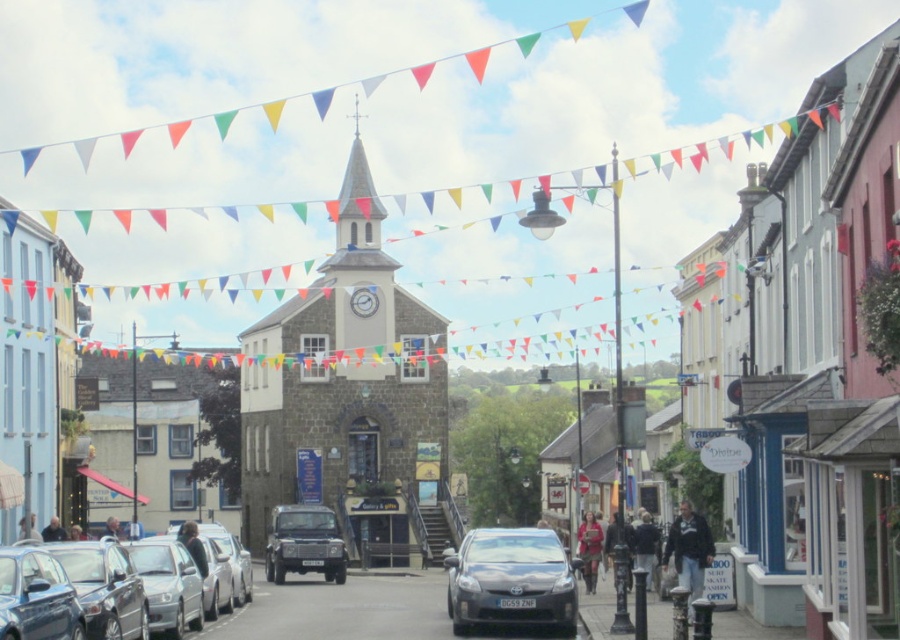
Question: Which point is closer to the camera?

Choices:
 (A) metallic gray sedan at center
 (B) metallic silver car at center

Answer: (B)

Question: Which object is the farthest from the matte black suv at center?

Choices:
 (A) metallic blue car at lower left
 (B) metallic silver car at center

Answer: (A)

Question: Based on their relative distances, which object is nearer to the metallic silver car at center?

Choices:
 (A) metallic gray sedan at center
 (B) metallic blue car at lower left
 (C) matte black suv at center

Answer: (B)

Question: Does stone clock tower at center appear over metallic blue car at lower left?

Choices:
 (A) no
 (B) yes

Answer: (B)

Question: Is stone clock tower at center thinner than metallic silver car at center?

Choices:
 (A) no
 (B) yes

Answer: (A)

Question: Can you confirm if metallic blue car at lower left is wider than matte black suv at center?

Choices:
 (A) no
 (B) yes

Answer: (A)